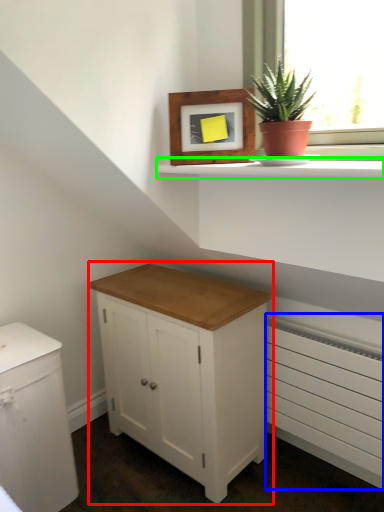
Question: Which object is positioned farthest from chest of drawers (highlighted by a red box)? Select from radiator (highlighted by a blue box) and window sill (highlighted by a green box).

Choices:
 (A) radiator
 (B) window sill

Answer: (B)